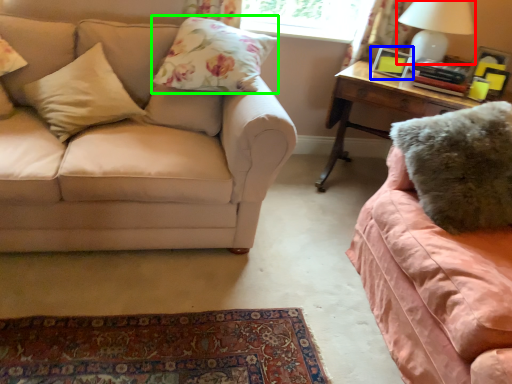
Question: Considering the real-world distances, which object is farthest from table lamp (highlighted by a red box)? picture frame (highlighted by a blue box) or pillow (highlighted by a green box)?

Choices:
 (A) picture frame
 (B) pillow

Answer: (B)